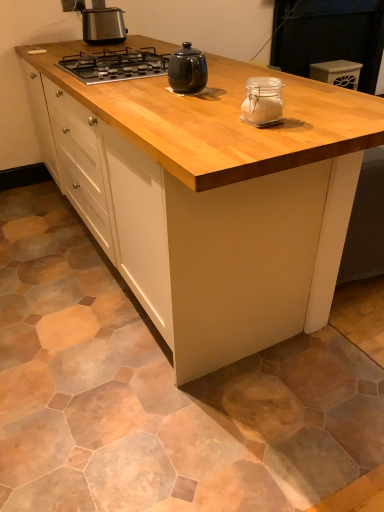
The width and height of the screenshot is (384, 512). What do you see at coordinates (337, 73) in the screenshot? I see `white plastic container at upper right` at bounding box center [337, 73].

This screenshot has height=512, width=384. What do you see at coordinates (187, 70) in the screenshot? I see `glossy ceramic mug at upper center, which ranks as the second kitchen appliance in bottom-to-top order` at bounding box center [187, 70].

This screenshot has width=384, height=512. Identify the location of satin black toaster at upper left, the third kitchen appliance positioned from the front. (102, 24).

Find the location of a particular element. The width and height of the screenshot is (384, 512). white plastic container at upper right is located at coordinates (337, 73).

Considering the sizes of objects glossy ceramic mug at upper center, the 2th kitchen appliance from the front, and clear glass jar at center, the 3th kitchen appliance viewed from the back, in the image provided, who is thinner, glossy ceramic mug at upper center, the 2th kitchen appliance from the front, or clear glass jar at center, the 3th kitchen appliance viewed from the back,?

clear glass jar at center, the 3th kitchen appliance viewed from the back.

Is glossy ceramic mug at upper center, placed as the second kitchen appliance when sorted from back to front, in contact with clear glass jar at center, positioned as the 3th kitchen appliance in left-to-right order?

No.

Can we say glossy ceramic mug at upper center, the 2th kitchen appliance from the front, lies outside clear glass jar at center, which is the first kitchen appliance from right to left?

Yes, glossy ceramic mug at upper center, the 2th kitchen appliance from the front, is located beyond the bounds of clear glass jar at center, which is the first kitchen appliance from right to left.

Based on the photo, from a real-world perspective, is glossy ceramic mug at upper center, the 2th kitchen appliance from the front, above or below clear glass jar at center, positioned as the 3th kitchen appliance in left-to-right order?

glossy ceramic mug at upper center, the 2th kitchen appliance from the front, is situated higher than clear glass jar at center, positioned as the 3th kitchen appliance in left-to-right order, in the real world.

Is point (345, 66) positioned before point (76, 58)?

No, (345, 66) is behind (76, 58).

Can you confirm if white plastic container at upper right is wider than black glass gas stove at upper center?

In fact, white plastic container at upper right might be narrower than black glass gas stove at upper center.

The width and height of the screenshot is (384, 512). I want to click on appliance located behind the black glass gas stove at upper center, so click(x=337, y=73).

Who is smaller, natural wood cabinet at center or glossy ceramic mug at upper center, the 2th kitchen appliance from the front?

With smaller size is glossy ceramic mug at upper center, the 2th kitchen appliance from the front.

Based on their positions, is natural wood cabinet at center located to the left or right of glossy ceramic mug at upper center, the 2th kitchen appliance from the front?

In the image, natural wood cabinet at center appears on the left side of glossy ceramic mug at upper center, the 2th kitchen appliance from the front.

Can you confirm if white plastic container at upper right is shorter than natural wood cabinet at center?

Indeed, white plastic container at upper right has a lesser height compared to natural wood cabinet at center.

Which is in front, white plastic container at upper right or natural wood cabinet at center?

natural wood cabinet at center is in front.

Is natural wood cabinet at center completely or partially inside white plastic container at upper right?

That's incorrect, natural wood cabinet at center is not inside white plastic container at upper right.

What's the angular difference between white plastic container at upper right and natural wood cabinet at center's facing directions?

The angular difference between white plastic container at upper right and natural wood cabinet at center is 90 degrees.

From a real-world perspective, is satin black toaster at upper left, which ranks as the first kitchen appliance in back-to-front order, positioned over glossy ceramic mug at upper center, the 2th kitchen appliance from the front, based on gravity?

Yes.

From the image's perspective, does satin black toaster at upper left, which is the 3th kitchen appliance from right to left, appear lower than glossy ceramic mug at upper center, the second kitchen appliance in the top-to-bottom sequence?

Incorrect, from the image's perspective, satin black toaster at upper left, which is the 3th kitchen appliance from right to left, is higher than glossy ceramic mug at upper center, the second kitchen appliance in the top-to-bottom sequence.

From the picture: Between satin black toaster at upper left, which ranks as the first kitchen appliance in back-to-front order, and glossy ceramic mug at upper center, which appears as the second kitchen appliance when viewed from the left, which one has smaller width?

glossy ceramic mug at upper center, which appears as the second kitchen appliance when viewed from the left, is thinner.

Between satin black toaster at upper left, the 1th kitchen appliance viewed from the left, and clear glass jar at center, which ranks as the third kitchen appliance in top-to-bottom order, which one is positioned behind?

Positioned behind is satin black toaster at upper left, the 1th kitchen appliance viewed from the left.

Is point (88, 11) more distant than point (246, 115)?

Yes, it is behind point (246, 115).

From the image's perspective, which one is positioned higher, satin black toaster at upper left, marked as the 3th kitchen appliance in a bottom-to-top arrangement, or clear glass jar at center, marked as the 1th kitchen appliance in a bottom-to-top arrangement?

satin black toaster at upper left, marked as the 3th kitchen appliance in a bottom-to-top arrangement, is shown above in the image.

Does satin black toaster at upper left, marked as the first kitchen appliance in a top-to-bottom arrangement, have a larger size compared to clear glass jar at center, which is the first kitchen appliance from front to back?

Yes, satin black toaster at upper left, marked as the first kitchen appliance in a top-to-bottom arrangement, is bigger than clear glass jar at center, which is the first kitchen appliance from front to back.

Can you confirm if clear glass jar at center, which is the first kitchen appliance from front to back, is positioned to the right of satin black toaster at upper left, which ranks as the first kitchen appliance in back-to-front order?

Yes.

Considering the sizes of objects clear glass jar at center, the 3th kitchen appliance viewed from the back, and satin black toaster at upper left, marked as the 3th kitchen appliance in a bottom-to-top arrangement, in the image provided, who is thinner, clear glass jar at center, the 3th kitchen appliance viewed from the back, or satin black toaster at upper left, marked as the 3th kitchen appliance in a bottom-to-top arrangement,?

Thinner between the two is clear glass jar at center, the 3th kitchen appliance viewed from the back.

Are clear glass jar at center, which is the first kitchen appliance from front to back, and satin black toaster at upper left, which is the 3th kitchen appliance from right to left, making contact?

No.

Could you tell me if clear glass jar at center, marked as the 1th kitchen appliance in a bottom-to-top arrangement, is turned towards satin black toaster at upper left, marked as the 3th kitchen appliance in a bottom-to-top arrangement?

No, clear glass jar at center, marked as the 1th kitchen appliance in a bottom-to-top arrangement, is not facing towards satin black toaster at upper left, marked as the 3th kitchen appliance in a bottom-to-top arrangement.

Where is `the 1st kitchen appliance directly above the clear glass jar at center, which is the first kitchen appliance from right to left (from a real-world perspective)`? This screenshot has width=384, height=512. the 1st kitchen appliance directly above the clear glass jar at center, which is the first kitchen appliance from right to left (from a real-world perspective) is located at coordinates (187, 70).

Image resolution: width=384 pixels, height=512 pixels. In the image, there is a black glass gas stove at upper center. What are the coordinates of `appliance above it (from the image's perspective)` in the screenshot? It's located at (337, 73).

Based on their spatial positions, is glossy ceramic mug at upper center, the 2th kitchen appliance from the front, or satin black toaster at upper left, the 1th kitchen appliance viewed from the left, further from clear glass jar at center, which is the first kitchen appliance from front to back?

satin black toaster at upper left, the 1th kitchen appliance viewed from the left.

Considering their positions, is glossy ceramic mug at upper center, the second kitchen appliance in the top-to-bottom sequence, positioned further to black glass gas stove at upper center than clear glass jar at center, positioned as the 3th kitchen appliance in left-to-right order?

Among the two, clear glass jar at center, positioned as the 3th kitchen appliance in left-to-right order, is located further to black glass gas stove at upper center.

From the image, which object appears to be nearer to white plastic container at upper right, satin black toaster at upper left, marked as the first kitchen appliance in a top-to-bottom arrangement, or black glass gas stove at upper center?

Based on the image, satin black toaster at upper left, marked as the first kitchen appliance in a top-to-bottom arrangement, appears to be nearer to white plastic container at upper right.

Considering their positions, is satin black toaster at upper left, the 1th kitchen appliance viewed from the left, positioned further to black glass gas stove at upper center than glossy ceramic mug at upper center, which ranks as the second kitchen appliance in bottom-to-top order?

The object further to black glass gas stove at upper center is satin black toaster at upper left, the 1th kitchen appliance viewed from the left.

From the image, which object appears to be nearer to satin black toaster at upper left, which is the 3th kitchen appliance from right to left, glossy ceramic mug at upper center, placed as the second kitchen appliance when sorted from back to front, or natural wood cabinet at center?

glossy ceramic mug at upper center, placed as the second kitchen appliance when sorted from back to front, is closer to satin black toaster at upper left, which is the 3th kitchen appliance from right to left.

Considering their positions, is white plastic container at upper right positioned closer to black glass gas stove at upper center than natural wood cabinet at center?

natural wood cabinet at center is closer to black glass gas stove at upper center.

From the image, which object appears to be farther from white plastic container at upper right, glossy ceramic mug at upper center, which appears as the 2th kitchen appliance when viewed from the right, or satin black toaster at upper left, which ranks as the first kitchen appliance in back-to-front order?

glossy ceramic mug at upper center, which appears as the 2th kitchen appliance when viewed from the right, is further to white plastic container at upper right.

Considering their positions, is black glass gas stove at upper center positioned closer to natural wood cabinet at center than clear glass jar at center, positioned as the 3th kitchen appliance in left-to-right order?

clear glass jar at center, positioned as the 3th kitchen appliance in left-to-right order, is positioned closer to the anchor natural wood cabinet at center.

You are a GUI agent. You are given a task and a screenshot of the screen. Output one action in this format:
    pyautogui.click(x=<x>, y=<y>)
    Task: Click on the gas stove located between clear glass jar at center, marked as the 1th kitchen appliance in a bottom-to-top arrangement, and white plastic container at upper right in the depth direction
    The height and width of the screenshot is (512, 384).
    Given the screenshot: What is the action you would take?
    pyautogui.click(x=115, y=65)

What are the coordinates of `gas stove between clear glass jar at center, marked as the 1th kitchen appliance in a bottom-to-top arrangement, and satin black toaster at upper left, the third kitchen appliance positioned from the front, from front to back` in the screenshot? It's located at (115, 65).

Locate an element on the screen. The height and width of the screenshot is (512, 384). gas stove located between natural wood cabinet at center and satin black toaster at upper left, which ranks as the first kitchen appliance in back-to-front order, in the depth direction is located at coordinates (115, 65).

Image resolution: width=384 pixels, height=512 pixels. I want to click on gas stove located between satin black toaster at upper left, marked as the 3th kitchen appliance in a bottom-to-top arrangement, and white plastic container at upper right in the left-right direction, so click(115, 65).